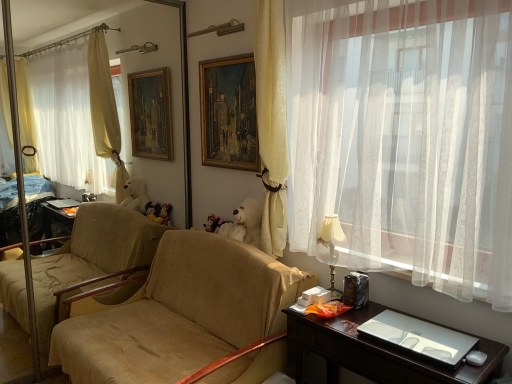
This screenshot has width=512, height=384. What do you see at coordinates (272, 120) in the screenshot?
I see `yellow fabric curtain at center, positioned as the first curtain in left-to-right order` at bounding box center [272, 120].

Where is `velvet plush toy at center`? velvet plush toy at center is located at coordinates (214, 223).

You are a GUI agent. You are given a task and a screenshot of the screen. Output one action in this format:
    pyautogui.click(x=<x>, y=<y>)
    Task: Click on the creamy fabric lampshade at right
    
    Given the screenshot: What is the action you would take?
    pyautogui.click(x=331, y=248)

From the picture: Is velvet plush toy at center positioned in front of shiny dark wood desk at lower right?

No, it is behind shiny dark wood desk at lower right.

Can you confirm if velvet plush toy at center is positioned to the left of shiny dark wood desk at lower right?

Indeed, velvet plush toy at center is positioned on the left side of shiny dark wood desk at lower right.

This screenshot has width=512, height=384. Identify the location of toy on the left of shiny dark wood desk at lower right. (214, 223).

Can you confirm if velvet plush toy at center is bigger than shiny dark wood desk at lower right?

Actually, velvet plush toy at center might be smaller than shiny dark wood desk at lower right.

Is white plush teddy bear at center to the left or to the right of yellow fabric curtain at center, the 2th curtain from the right, in the image?

white plush teddy bear at center is positioned on yellow fabric curtain at center, the 2th curtain from the right,'s left side.

Consider the image. Is white plush teddy bear at center not inside yellow fabric curtain at center, positioned as the first curtain in left-to-right order?

Indeed, white plush teddy bear at center is completely outside yellow fabric curtain at center, positioned as the first curtain in left-to-right order.

From a real-world perspective, is white plush teddy bear at center above or below yellow fabric curtain at center, positioned as the first curtain in left-to-right order?

white plush teddy bear at center is below yellow fabric curtain at center, positioned as the first curtain in left-to-right order.

Considering the relative sizes of white plush teddy bear at center and yellow fabric curtain at center, the 2th curtain from the right, in the image provided, is white plush teddy bear at center shorter than yellow fabric curtain at center, the 2th curtain from the right,?

Yes, white plush teddy bear at center is shorter than yellow fabric curtain at center, the 2th curtain from the right.

Considering their positions, is white sheer curtain at right, the 1th curtain positioned from the right, located in front of or behind creamy fabric lampshade at right?

white sheer curtain at right, the 1th curtain positioned from the right, is positioned closer to the viewer than creamy fabric lampshade at right.

Which point is more forward, (257, 42) or (328, 227)?

Positioned in front is point (328, 227).

Is white sheer curtain at right, the 1th curtain positioned from the right, at the left side of creamy fabric lampshade at right?

No.

From the image's perspective, is shiny dark wood desk at lower right on top of yellow fabric curtain at center, positioned as the first curtain in left-to-right order?

Incorrect, from the image's perspective, shiny dark wood desk at lower right is lower than yellow fabric curtain at center, positioned as the first curtain in left-to-right order.

Is shiny dark wood desk at lower right looking in the opposite direction of yellow fabric curtain at center, the 2th curtain from the right?

No, shiny dark wood desk at lower right's orientation is not away from yellow fabric curtain at center, the 2th curtain from the right.

What's the angular difference between shiny dark wood desk at lower right and yellow fabric curtain at center, positioned as the first curtain in left-to-right order,'s facing directions?

The angle between the facing direction of shiny dark wood desk at lower right and the facing direction of yellow fabric curtain at center, positioned as the first curtain in left-to-right order, is 2.91 degrees.

In the image, there is a yellow fabric curtain at center, positioned as the first curtain in left-to-right order. Where is `desk below it (from the image's perspective)`? The height and width of the screenshot is (384, 512). desk below it (from the image's perspective) is located at coordinates (374, 353).

Which of these two, velvet plush toy at center or creamy fabric lampshade at right, stands shorter?

With less height is velvet plush toy at center.

Is point (217, 222) less distant than point (336, 297)?

No, (217, 222) is behind (336, 297).

From a real-world perspective, who is located lower, velvet plush toy at center or creamy fabric lampshade at right?

In real-world perspective, velvet plush toy at center is lower.

Could you tell me if velvet plush toy at center is turned towards creamy fabric lampshade at right?

No, velvet plush toy at center is not oriented towards creamy fabric lampshade at right.

Which is more to the left, white sheer curtain at right, the second curtain positioned from the left, or shiny dark wood desk at lower right?

white sheer curtain at right, the second curtain positioned from the left.

Is the depth of white sheer curtain at right, the 1th curtain positioned from the right, less than that of shiny dark wood desk at lower right?

That is True.

Measure the distance between white sheer curtain at right, the 1th curtain positioned from the right, and shiny dark wood desk at lower right.

A distance of 29.39 inches exists between white sheer curtain at right, the 1th curtain positioned from the right, and shiny dark wood desk at lower right.

Which of these two, white sheer curtain at right, the second curtain positioned from the left, or shiny dark wood desk at lower right, is thinner?

Thinner between the two is white sheer curtain at right, the second curtain positioned from the left.

Considering the positions of points (330, 214) and (202, 108), is point (330, 214) closer to camera compared to point (202, 108)?

That is True.

Is creamy fabric lampshade at right in front of or behind wooden oil painting at center in the image?

creamy fabric lampshade at right is in front of wooden oil painting at center.

Image resolution: width=512 pixels, height=384 pixels. Find the location of `desk beneath the velvet plush toy at center (from a real-world perspective)`. desk beneath the velvet plush toy at center (from a real-world perspective) is located at coordinates (374, 353).

What are the coordinates of `the 2nd curtain above the white plush teddy bear at center (from the image's perspective)` in the screenshot? It's located at (272, 120).

From the image, which object appears to be nearer to velvet plush toy at center, white plush teddy bear at center or white sheer curtain at right, the second curtain positioned from the left?

white plush teddy bear at center lies closer to velvet plush toy at center than the other object.

Looking at this image, from the image, which object appears to be farther from beige fabric couch at center, yellow fabric curtain at center, positioned as the first curtain in left-to-right order, or wooden oil painting at center?

wooden oil painting at center is positioned further to the anchor beige fabric couch at center.

Estimate the real-world distances between objects in this image. Which object is closer to shiny dark wood desk at lower right, wooden oil painting at center or creamy fabric lampshade at right?

Based on the image, creamy fabric lampshade at right appears to be nearer to shiny dark wood desk at lower right.

Based on the photo, when comparing their distances from velvet plush toy at center, does white sheer curtain at right, the 1th curtain positioned from the right, or shiny dark wood desk at lower right seem further?

white sheer curtain at right, the 1th curtain positioned from the right, is further to velvet plush toy at center.

Based on their spatial positions, is wooden oil painting at center or beige fabric couch at center closer to shiny dark wood desk at lower right?

beige fabric couch at center.

From the image, which object appears to be nearer to velvet plush toy at center, white sheer curtain at right, the 1th curtain positioned from the right, or white plush teddy bear at center?

white plush teddy bear at center is positioned closer to the anchor velvet plush toy at center.

When comparing their distances from white sheer curtain at right, the second curtain positioned from the left, does yellow fabric curtain at center, the 2th curtain from the right, or velvet plush toy at center seem further?

velvet plush toy at center is positioned further to the anchor white sheer curtain at right, the second curtain positioned from the left.

When comparing their distances from shiny dark wood desk at lower right, does wooden oil painting at center or white plush teddy bear at center seem closer?

white plush teddy bear at center is closer to shiny dark wood desk at lower right.

Identify the location of lamp between yellow fabric curtain at center, the 2th curtain from the right, and beige fabric couch at center in the up-down direction. (331, 248).

Find the location of a particular element. Image resolution: width=512 pixels, height=384 pixels. teddy bear between beige fabric couch at center and velvet plush toy at center in the front-back direction is located at coordinates (245, 223).

Locate an element on the screen. The height and width of the screenshot is (384, 512). picture frame between beige fabric couch at center and velvet plush toy at center in the front-back direction is located at coordinates (229, 113).

Find the location of a particular element. curtain between creamy fabric lampshade at right and velvet plush toy at center along the z-axis is located at coordinates (272, 120).